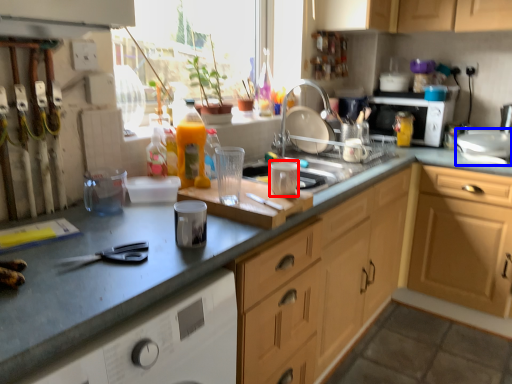
Question: Which point is further to the camera, appliance (highlighted by a red box) or appliance (highlighted by a blue box)?

Choices:
 (A) appliance
 (B) appliance

Answer: (B)